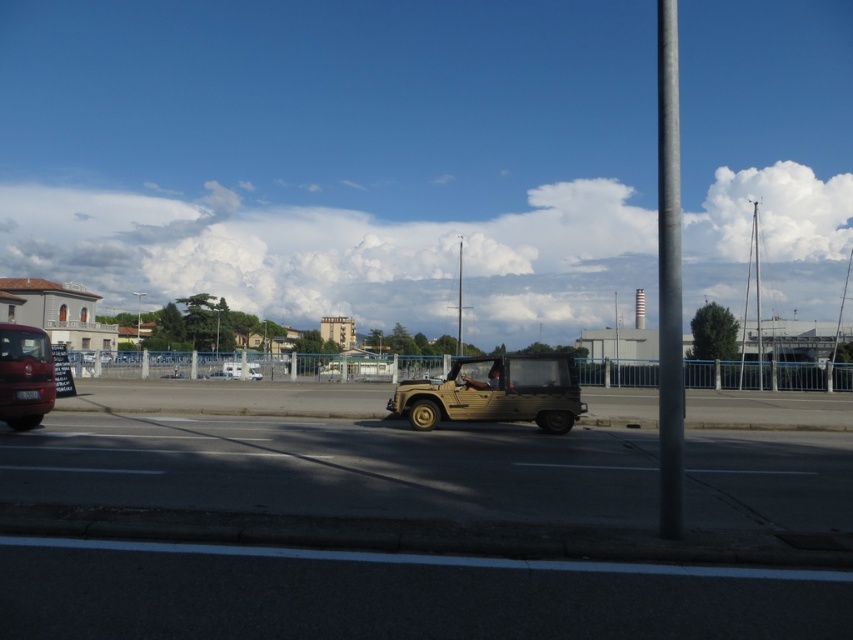
Where is `smooth gray pole at right`? The width and height of the screenshot is (853, 640). smooth gray pole at right is located at coordinates (669, 278).

Locate an element on the screen. smooth gray pole at right is located at coordinates (669, 278).

Describe the element at coordinates (495, 392) in the screenshot. The width and height of the screenshot is (853, 640). I see `matte khaki jeep at center` at that location.

Is matte khaki jeep at center closer to the viewer compared to shiny red bus at left?

No, it is not.

Between point (473, 362) and point (21, 371), which one is positioned in front?

Positioned in front is point (21, 371).

Where is `matte khaki jeep at center`? The width and height of the screenshot is (853, 640). matte khaki jeep at center is located at coordinates (495, 392).

Which is above, smooth gray pole at right or matte khaki jeep at center?

smooth gray pole at right is above.

Is point (660, 33) positioned after point (556, 358)?

That is True.

You are a GUI agent. You are given a task and a screenshot of the screen. Output one action in this format:
    pyautogui.click(x=<x>, y=<y>)
    Task: Click on the smooth gray pole at right
    
    Given the screenshot: What is the action you would take?
    pyautogui.click(x=669, y=278)